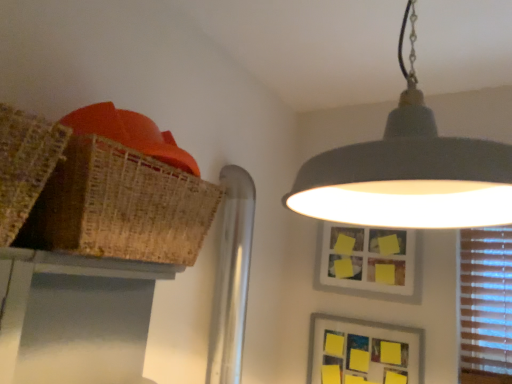
Question: Looking at the image, does bamboo table at upper left seem bigger or smaller compared to yellow paper picture frame at lower right, the first picture frame when ordered from bottom to top?

Choices:
 (A) small
 (B) big

Answer: (B)

Question: Which is correct: bamboo table at upper left is inside yellow paper picture frame at lower right, the first picture frame when ordered from bottom to top, or outside of it?

Choices:
 (A) inside
 (B) outside

Answer: (B)

Question: Based on their relative distances, which object is nearer to the matte gray lampshade at upper center?

Choices:
 (A) bamboo table at upper left
 (B) braided wicker basket at upper left
 (C) yellow paper picture frame at lower right, which is counted as the second picture frame, starting from the top
 (D) yellow matte picture frame at upper center, marked as the 2th picture frame in a bottom-to-top arrangement

Answer: (B)

Question: Based on their relative distances, which object is nearer to the bamboo table at upper left?

Choices:
 (A) yellow paper picture frame at lower right, which is counted as the second picture frame, starting from the top
 (B) braided wicker basket at upper left
 (C) matte gray lampshade at upper center
 (D) yellow matte picture frame at upper center, marked as the 2th picture frame in a bottom-to-top arrangement

Answer: (B)